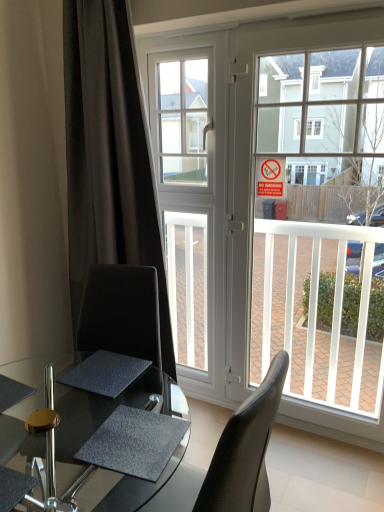
The height and width of the screenshot is (512, 384). What do you see at coordinates (104, 416) in the screenshot? I see `transparent glass table at center` at bounding box center [104, 416].

What is the approximate height of dark matte curtain at left?

dark matte curtain at left is 7.31 feet in height.

You are a GUI agent. You are given a task and a screenshot of the screen. Output one action in this format:
    pyautogui.click(x=<x>, y=<y>)
    Task: Click on the red paper sign at upper center
    The image size is (384, 512).
    Given the screenshot: What is the action you would take?
    pyautogui.click(x=270, y=177)

Between dark matte curtain at left and transparent glass table at center, which one has less height?

transparent glass table at center.

Does dark matte curtain at left have a larger size compared to transparent glass table at center?

Yes, dark matte curtain at left is bigger than transparent glass table at center.

From the image's perspective, is dark matte curtain at left above or below transparent glass table at center?

From the image's perspective, dark matte curtain at left appears above transparent glass table at center.

Which object is thinner, dark matte curtain at left or transparent glass table at center?

With smaller width is dark matte curtain at left.

Looking at this image, which of these two, white glass window at center or dark matte curtain at left, is wider?

With larger width is dark matte curtain at left.

Would you consider white glass window at center to be distant from dark matte curtain at left?

They are positioned close to each other.

Which of these two, white glass window at center or dark matte curtain at left, stands taller?

Standing taller between the two is dark matte curtain at left.

From a real-world perspective, which object rests below the other?

dark matte curtain at left.

From a real-world perspective, is clear glass door at center positioned over red paper sign at upper center based on gravity?

No, from a real-world perspective, clear glass door at center is not above red paper sign at upper center.

From the image's perspective, relative to red paper sign at upper center, is clear glass door at center above or below?

Based on their image positions, clear glass door at center is located beneath red paper sign at upper center.

Who is more distant, clear glass door at center or red paper sign at upper center?

red paper sign at upper center is more distant.

How much distance is there between transparent glass table at center and clear glass door at center?

They are 3.31 feet apart.

From a real-world perspective, is transparent glass table at center physically located above or below clear glass door at center?

transparent glass table at center is below clear glass door at center.

Based on their sizes in the image, would you say transparent glass table at center is bigger or smaller than clear glass door at center?

Clearly, transparent glass table at center is larger in size than clear glass door at center.

How many degrees apart are the facing directions of dark matte curtain at left and red paper sign at upper center?

There is a 0.00466-degree angle between the facing directions of dark matte curtain at left and red paper sign at upper center.

Consider the image. Is dark matte curtain at left aimed at red paper sign at upper center?

No, dark matte curtain at left is not oriented towards red paper sign at upper center.

Can you confirm if dark matte curtain at left is taller than red paper sign at upper center?

Yes.

Is dark matte curtain at left next to red paper sign at upper center and touching it?

No, dark matte curtain at left is not making contact with red paper sign at upper center.

Is clear glass door at center closer to camera compared to dark matte curtain at left?

No, clear glass door at center is behind dark matte curtain at left.

Is clear glass door at center inside or outside of dark matte curtain at left?

clear glass door at center is located beyond the bounds of dark matte curtain at left.

You are a GUI agent. You are given a task and a screenshot of the screen. Output one action in this format:
    pyautogui.click(x=<x>, y=<y>)
    Task: Click on the window located behind the dark matte curtain at left
    
    Given the screenshot: What is the action you would take?
    pyautogui.click(x=275, y=205)

Between clear glass door at center and dark matte curtain at left, which one has larger size?

dark matte curtain at left.

Where is `curtain above the clear glass door at center (from a real-world perspective)`? The height and width of the screenshot is (512, 384). curtain above the clear glass door at center (from a real-world perspective) is located at coordinates (109, 155).

Considering the relative sizes of dark matte curtain at left and clear glass door at center in the image provided, is dark matte curtain at left wider than clear glass door at center?

Yes, dark matte curtain at left is wider than clear glass door at center.

From their relative heights in the image, would you say dark matte curtain at left is taller or shorter than clear glass door at center?

Clearly, dark matte curtain at left is taller compared to clear glass door at center.

Consider the image. Is dark matte curtain at left oriented towards clear glass door at center?

No, dark matte curtain at left is not facing towards clear glass door at center.

This screenshot has width=384, height=512. Find the location of `table below the dark matte curtain at left (from a real-world perspective)`. table below the dark matte curtain at left (from a real-world perspective) is located at coordinates (104, 416).

Identify the location of window screen that appears behind the dark matte curtain at left. This screenshot has width=384, height=512. (182, 120).

Considering their positions, is transparent glass table at center positioned further to white glass window at center than clear glass door at center?

transparent glass table at center.

Looking at the image, which one is located further to dark matte curtain at left, red paper sign at upper center or clear glass door at center?

red paper sign at upper center lies further to dark matte curtain at left than the other object.

Which object lies further to the anchor point red paper sign at upper center, dark matte curtain at left or white glass window at center?

Based on the image, dark matte curtain at left appears to be further to red paper sign at upper center.

Based on their spatial positions, is red paper sign at upper center or dark matte curtain at left further from white glass window at center?

red paper sign at upper center is positioned further to the anchor white glass window at center.

Looking at the image, which one is located further to red paper sign at upper center, dark matte curtain at left or clear glass door at center?

Among the two, dark matte curtain at left is located further to red paper sign at upper center.

When comparing their distances from white glass window at center, does red paper sign at upper center or clear glass door at center seem further?

The object further to white glass window at center is red paper sign at upper center.

From the image, which object appears to be farther from transparent glass table at center, dark matte curtain at left or red paper sign at upper center?

red paper sign at upper center is positioned further to the anchor transparent glass table at center.

Which object lies nearer to the anchor point dark matte curtain at left, transparent glass table at center or white glass window at center?

The object closer to dark matte curtain at left is white glass window at center.

The height and width of the screenshot is (512, 384). Find the location of `window screen between dark matte curtain at left and red paper sign at upper center in the horizontal direction`. window screen between dark matte curtain at left and red paper sign at upper center in the horizontal direction is located at coordinates (182, 120).

The image size is (384, 512). What are the coordinates of `table between dark matte curtain at left and clear glass door at center in the horizontal direction` in the screenshot? It's located at (104, 416).

This screenshot has height=512, width=384. Identify the location of parking sign between white glass window at center and clear glass door at center in the vertical direction. (270, 177).

Find the location of a particular element. This screenshot has height=512, width=384. window between red paper sign at upper center and transparent glass table at center in the up-down direction is located at coordinates (275, 205).